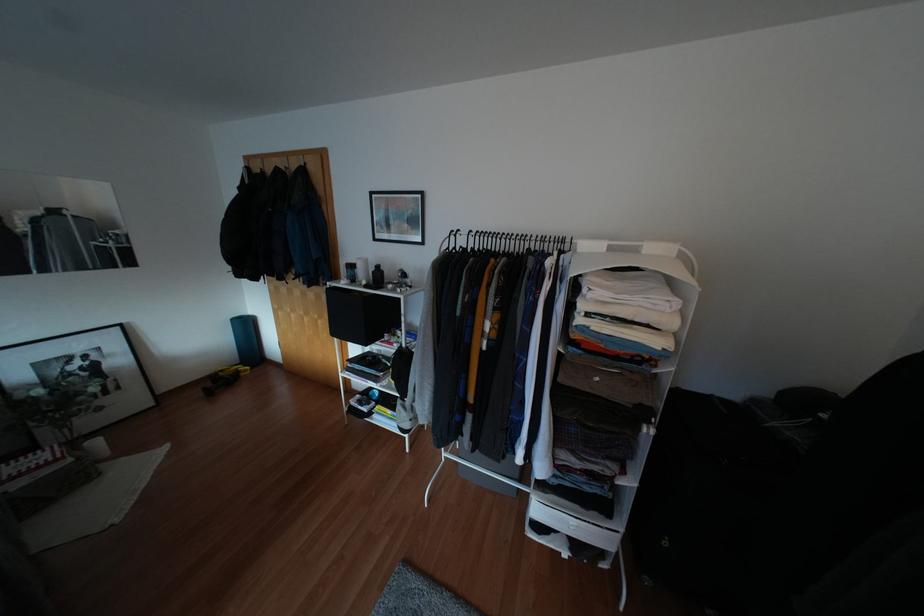
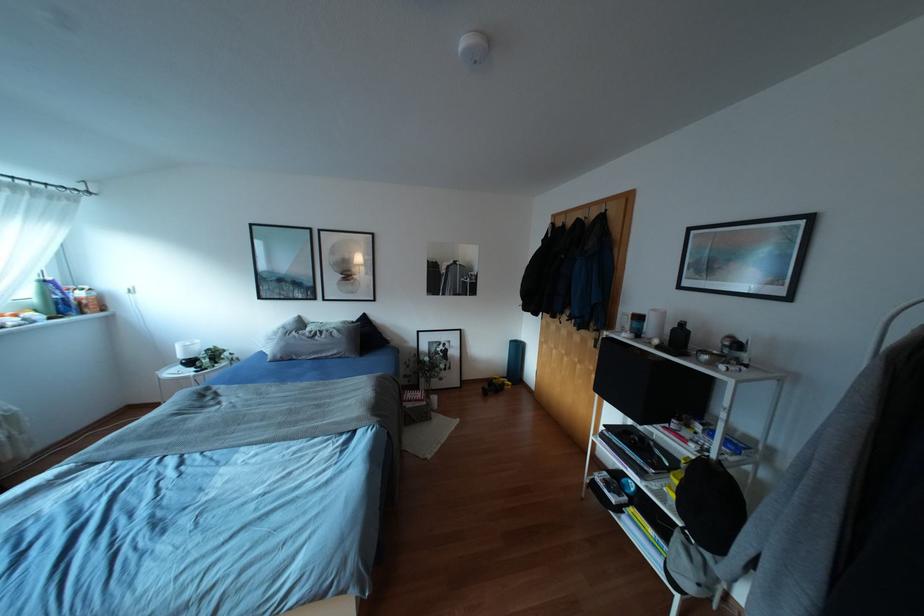
Question: The images are taken continuously from a first-person perspective. In which direction is your viewpoint rotating?

Choices:
 (A) Left
 (B) Right
 (C) Up
 (D) Down

Answer: (A)